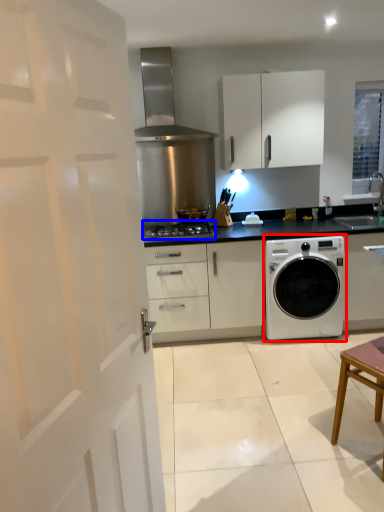
Question: Which object appears closest to the camera in this image, washing machine (highlighted by a red box) or gas stove (highlighted by a blue box)?

Choices:
 (A) washing machine
 (B) gas stove

Answer: (A)